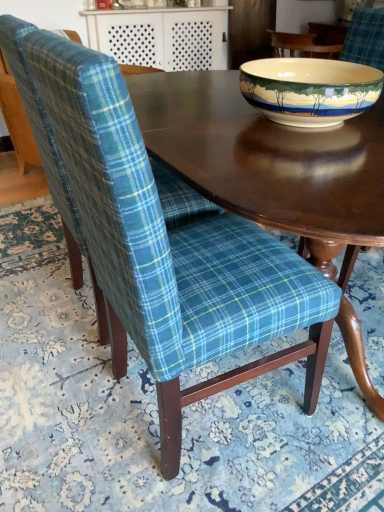
Question: Is blue plaid fabric chair at left, the 1th chair positioned from the back, bigger than smooth dark wood table at upper center?

Choices:
 (A) yes
 (B) no

Answer: (A)

Question: Is smooth dark wood table at upper center located within blue plaid fabric chair at left, the 1th chair positioned from the back?

Choices:
 (A) no
 (B) yes

Answer: (A)

Question: Is blue plaid fabric chair at left, the second chair positioned from the front, at the left side of smooth dark wood table at upper center?

Choices:
 (A) no
 (B) yes

Answer: (A)

Question: From a real-world perspective, is blue plaid fabric chair at left, the 1th chair positioned from the back, under smooth dark wood table at upper center?

Choices:
 (A) no
 (B) yes

Answer: (B)

Question: Would you say blue plaid fabric chair at left, the 1th chair positioned from the back, is outside smooth dark wood table at upper center?

Choices:
 (A) no
 (B) yes

Answer: (B)

Question: Is blue plaid fabric chair at left, the second chair positioned from the front, placed right next to smooth dark wood table at upper center?

Choices:
 (A) yes
 (B) no

Answer: (B)

Question: Could you tell me if smooth dark wood table at upper center is facing porcelain bowl at upper right?

Choices:
 (A) no
 (B) yes

Answer: (B)

Question: Is smooth dark wood table at upper center further to the viewer compared to porcelain bowl at upper right?

Choices:
 (A) yes
 (B) no

Answer: (A)

Question: Is smooth dark wood table at upper center closer to the viewer compared to porcelain bowl at upper right?

Choices:
 (A) no
 (B) yes

Answer: (A)

Question: Can you confirm if smooth dark wood table at upper center is positioned to the left of porcelain bowl at upper right?

Choices:
 (A) no
 (B) yes

Answer: (B)

Question: Considering the relative sizes of smooth dark wood table at upper center and porcelain bowl at upper right in the image provided, is smooth dark wood table at upper center shorter than porcelain bowl at upper right?

Choices:
 (A) no
 (B) yes

Answer: (A)

Question: From a real-world perspective, is smooth dark wood table at upper center located beneath porcelain bowl at upper right?

Choices:
 (A) yes
 (B) no

Answer: (A)

Question: Is teal plaid fabric chair at center, the second chair in the back-to-front sequence, to the right of porcelain bowl at upper right from the viewer's perspective?

Choices:
 (A) no
 (B) yes

Answer: (A)